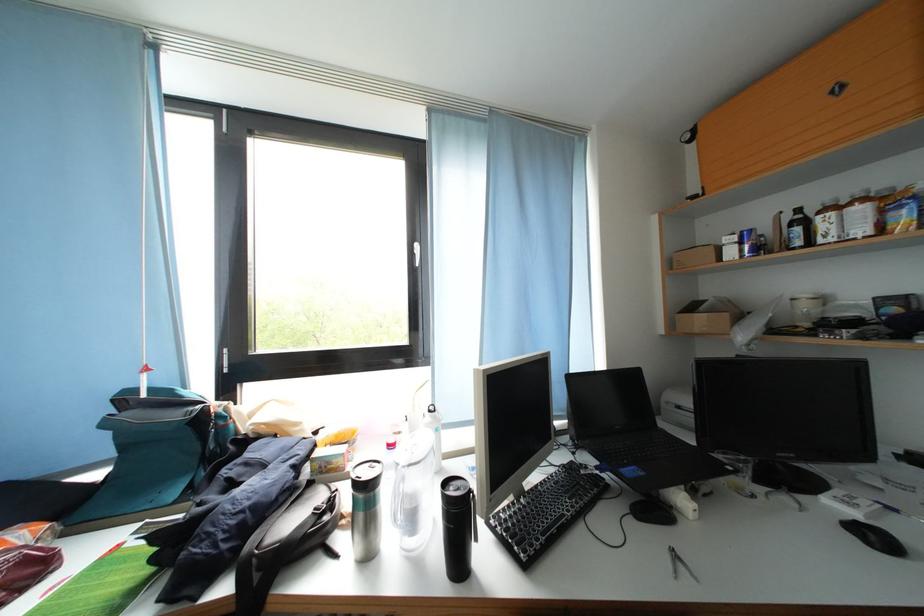
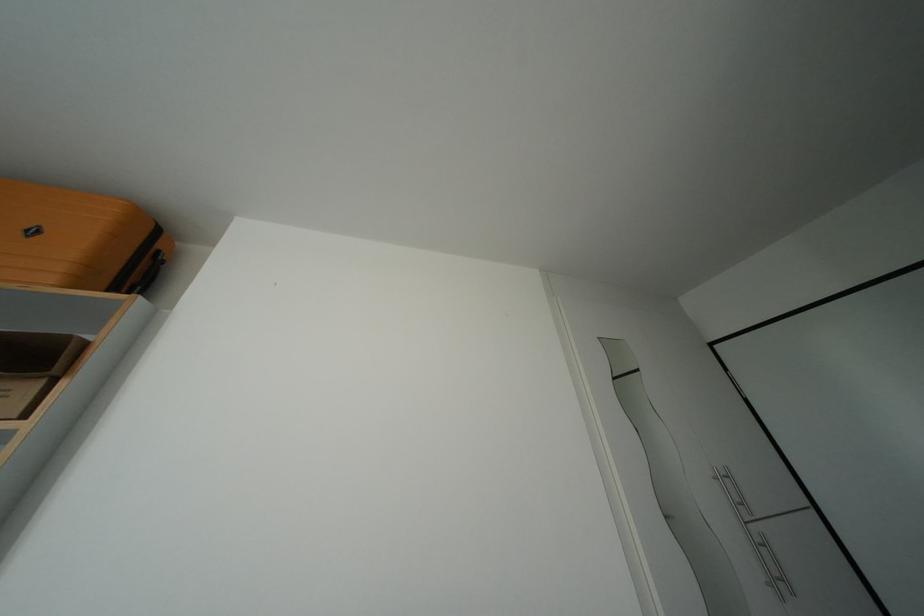
The first image is from the beginning of the video and the second image is from the end. How did the camera likely rotate when shooting the video?

The camera's rotation is toward right-up.